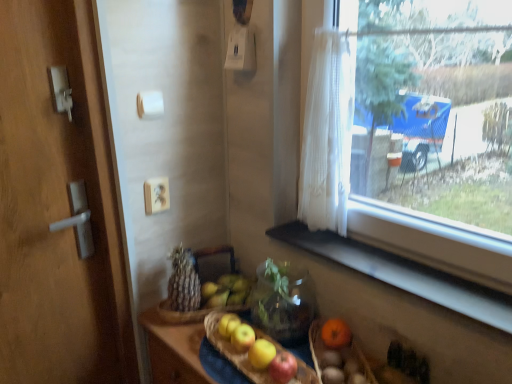
Identify the location of vacant area on top of black matte window sill at lower right (from a real-world perspective). The width and height of the screenshot is (512, 384). (386, 259).